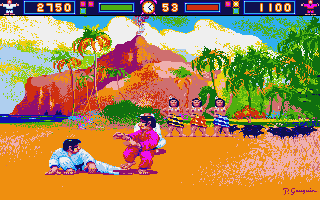
This screenshot has width=320, height=200. I want to click on alarm clock, so point(146,5).